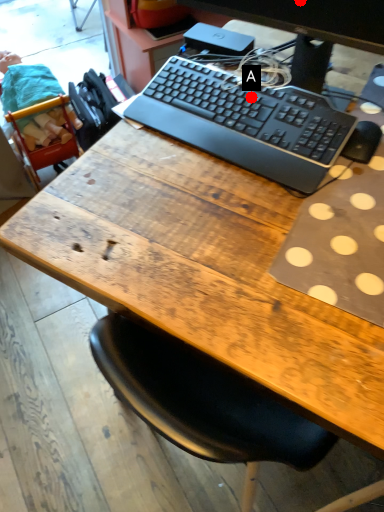
Question: Two points are circled on the image, labeled by A and B beside each circle. Which point is closer to the camera?

Choices:
 (A) A is closer
 (B) B is closer

Answer: (B)